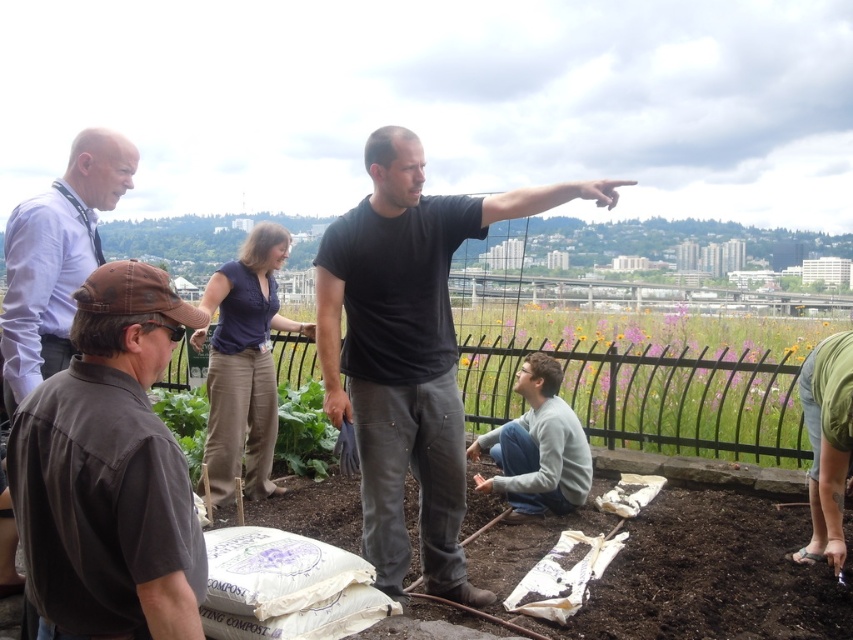
You are a photographer trying to capture a photo of the black matte shirt at center without including the brown fabric cap at lower left in the frame. Based on their positions, is this possible?

The brown fabric cap at lower left is positioned under the black matte shirt at center, so it is possible to capture the black matte shirt at center without including the brown fabric cap at lower left by adjusting the camera angle to exclude the lower area where the cap is located.

You are standing at the point labeled point (158, 452) and want to walk to the point labeled point (399, 451). Which direction should you move relative to the other point?

You should move backward since point (158, 452) is in front of point (399, 451).

You are standing in the garden and want to move from the point at coordinates point (563,189) to the point at coordinates point (28,314). Which direction should you move to get closer to your destination?

You should move downward because point (563,189) is further to the viewer than point (28,314), so moving downward will bring you closer to the destination.